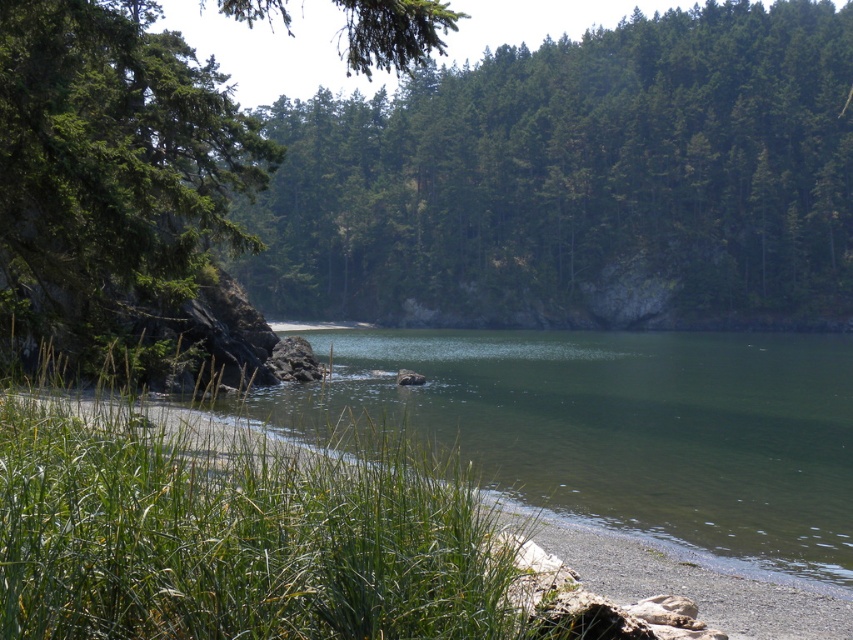
You are standing at the edge of the lake and see two points marked on the ground. The first point is at coordinate point(543,115) and the second is at point(364,534). If you want to reach the point that is closer to you, which coordinate should you walk towards?

You should walk towards point(364,534) because it is closer to you than point(543,115).

You are standing at the edge of the water and want to walk towards the green textured tree at upper center. Which direction should you walk to avoid stepping on the green grass at lower left?

To avoid stepping on the green grass at lower left, you should walk towards the green textured tree at upper center by moving away from the green grass at lower left since it is behind the tree.